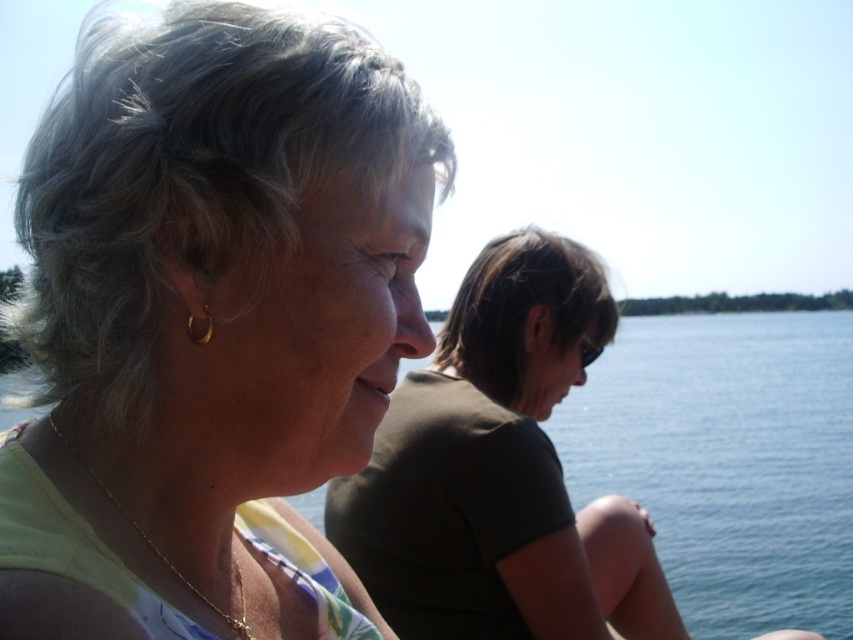
Question: Is matte yellow blouse at center to the left of dark brown fabric at center from the viewer's perspective?

Choices:
 (A) yes
 (B) no

Answer: (A)

Question: Is matte yellow blouse at center behind dark brown fabric at center?

Choices:
 (A) no
 (B) yes

Answer: (A)

Question: Among these points, which one is nearest to the camera?

Choices:
 (A) (281, 241)
 (B) (438, 392)

Answer: (A)

Question: Can you confirm if matte yellow blouse at center is positioned to the right of dark brown fabric at center?

Choices:
 (A) yes
 (B) no

Answer: (B)

Question: Among these objects, which one is farthest from the camera?

Choices:
 (A) dark brown fabric at center
 (B) matte yellow blouse at center

Answer: (A)

Question: Which object appears closest to the camera in this image?

Choices:
 (A) matte yellow blouse at center
 (B) dark brown fabric at center

Answer: (A)